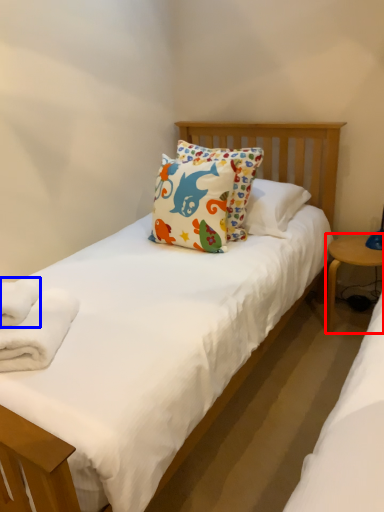
Question: Which object appears farthest to the camera in this image, table (highlighted by a red box) or bath towel (highlighted by a blue box)?

Choices:
 (A) table
 (B) bath towel

Answer: (A)